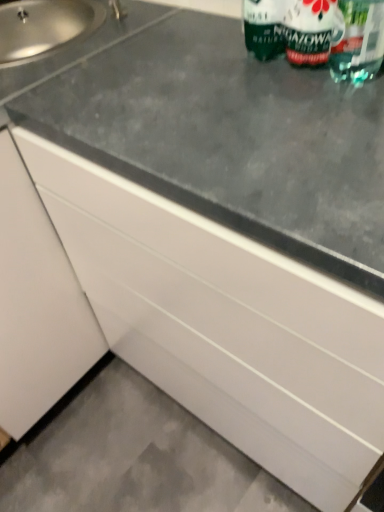
This screenshot has width=384, height=512. Describe the element at coordinates (81, 50) in the screenshot. I see `satin steel sink at upper left` at that location.

Image resolution: width=384 pixels, height=512 pixels. What do you see at coordinates (322, 33) in the screenshot?
I see `green matte bottle at upper right` at bounding box center [322, 33].

Locate an element on the screen. The height and width of the screenshot is (512, 384). silver metallic faucet at upper left is located at coordinates (117, 10).

From a real-world perspective, relative to green matte bottle at upper right, is satin steel sink at upper left vertically above or below?

satin steel sink at upper left is situated lower than green matte bottle at upper right in the real world.

Is satin steel sink at upper left wider than green matte bottle at upper right?

Yes, satin steel sink at upper left is wider than green matte bottle at upper right.

Who is more distant, satin steel sink at upper left or green matte bottle at upper right?

satin steel sink at upper left is more distant.

What's the angular difference between satin steel sink at upper left and green matte bottle at upper right's facing directions?

They differ by 49 degrees in their facing directions.

From their relative heights in the image, would you say gray concrete at lower left is taller or shorter than silver metallic faucet at upper left?

Considering their sizes, gray concrete at lower left has less height than silver metallic faucet at upper left.

Can you confirm if gray concrete at lower left is wider than silver metallic faucet at upper left?

Yes.

Is gray concrete at lower left inside the boundaries of silver metallic faucet at upper left, or outside?

gray concrete at lower left lies outside silver metallic faucet at upper left.

Which object is positioned more to the left, gray concrete at lower left or silver metallic faucet at upper left?

Positioned to the left is silver metallic faucet at upper left.

Which is behind, silver metallic faucet at upper left or gray concrete at lower left?

silver metallic faucet at upper left is behind.

From the image's perspective, which one is positioned lower, silver metallic faucet at upper left or gray concrete at lower left?

gray concrete at lower left.

How many degrees apart are the facing directions of silver metallic faucet at upper left and gray concrete at lower left?

silver metallic faucet at upper left and gray concrete at lower left are facing 0.928 degrees away from each other.

From a real-world perspective, between silver metallic faucet at upper left and gray concrete at lower left, who is vertically higher?

silver metallic faucet at upper left is physically above.

Which object is further away from the camera, transparent plastic straw at upper right or green matte bottle at upper right?

green matte bottle at upper right is further from the camera.

From a real-world perspective, between transparent plastic straw at upper right and green matte bottle at upper right, who is vertically higher?

transparent plastic straw at upper right, from a real-world perspective.

Does transparent plastic straw at upper right appear on the left side of green matte bottle at upper right?

No, transparent plastic straw at upper right is not to the left of green matte bottle at upper right.

Is point (345, 47) farther from viewer compared to point (313, 44)?

No, (345, 47) is closer to viewer.

Is silver metallic faucet at upper left shorter than green matte bottle at upper right?

Indeed, silver metallic faucet at upper left has a lesser height compared to green matte bottle at upper right.

Is silver metallic faucet at upper left outside of green matte bottle at upper right?

That's correct, silver metallic faucet at upper left is outside of green matte bottle at upper right.

From the image's perspective, is silver metallic faucet at upper left located beneath green matte bottle at upper right?

No, from the image's perspective, silver metallic faucet at upper left is not beneath green matte bottle at upper right.

Considering the sizes of objects green matte bottle at upper right and gray concrete at lower left in the image provided, who is thinner, green matte bottle at upper right or gray concrete at lower left?

green matte bottle at upper right.

Consider the image. Does green matte bottle at upper right contain gray concrete at lower left?

No, gray concrete at lower left is not a part of green matte bottle at upper right.

Considering the points (354, 49) and (39, 438), which point is behind, point (354, 49) or point (39, 438)?

The point (39, 438) is farther.

Does green matte bottle at upper right have a greater height compared to gray concrete at lower left?

Yes.

Locate an element on the screen. faucet above the transparent plastic straw at upper right (from the image's perspective) is located at coordinates (117, 10).

Based on the photo, from the image's perspective, does silver metallic faucet at upper left appear higher than transparent plastic straw at upper right?

Yes.

Does silver metallic faucet at upper left have a smaller size compared to transparent plastic straw at upper right?

Yes, silver metallic faucet at upper left is smaller than transparent plastic straw at upper right.

Which is more to the right, silver metallic faucet at upper left or transparent plastic straw at upper right?

transparent plastic straw at upper right is more to the right.

The height and width of the screenshot is (512, 384). I want to click on sink on the left side of green matte bottle at upper right, so click(x=81, y=50).

In the image, there is a gray concrete at lower left. Identify the location of faucet above it (from the image's perspective). (117, 10).

Which object lies further to the anchor point green matte bottle at upper right, gray concrete at lower left or transparent plastic straw at upper right?

gray concrete at lower left lies further to green matte bottle at upper right than the other object.

When comparing their distances from transparent plastic straw at upper right, does satin steel sink at upper left or green matte bottle at upper right seem further?

The object further to transparent plastic straw at upper right is satin steel sink at upper left.

Estimate the real-world distances between objects in this image. Which object is further from transparent plastic straw at upper right, silver metallic faucet at upper left or green matte bottle at upper right?

silver metallic faucet at upper left lies further to transparent plastic straw at upper right than the other object.

Looking at the image, which one is located further to satin steel sink at upper left, gray concrete at lower left or silver metallic faucet at upper left?

Based on the image, gray concrete at lower left appears to be further to satin steel sink at upper left.

From the image, which object appears to be farther from transparent plastic straw at upper right, satin steel sink at upper left or gray concrete at lower left?

gray concrete at lower left.

Estimate the real-world distances between objects in this image. Which object is closer to gray concrete at lower left, silver metallic faucet at upper left or satin steel sink at upper left?

The object closer to gray concrete at lower left is satin steel sink at upper left.

Looking at the image, which one is located closer to gray concrete at lower left, transparent plastic straw at upper right or silver metallic faucet at upper left?

transparent plastic straw at upper right.

Considering their positions, is gray concrete at lower left positioned closer to transparent plastic straw at upper right than green matte bottle at upper right?

The object closer to transparent plastic straw at upper right is green matte bottle at upper right.

At what (x,y) coordinates should I click in order to perform the action: click on bottle between satin steel sink at upper left and transparent plastic straw at upper right from left to right. Please return your answer as a coordinate pair (x, y). The height and width of the screenshot is (512, 384). Looking at the image, I should click on (322, 33).

Locate an element on the screen. The height and width of the screenshot is (512, 384). bottle between transparent plastic straw at upper right and silver metallic faucet at upper left in the front-back direction is located at coordinates (322, 33).

Identify the location of bottle between satin steel sink at upper left and gray concrete at lower left in the up-down direction. (322, 33).

Identify the location of drinking straw between satin steel sink at upper left and gray concrete at lower left vertically. Image resolution: width=384 pixels, height=512 pixels. (359, 41).